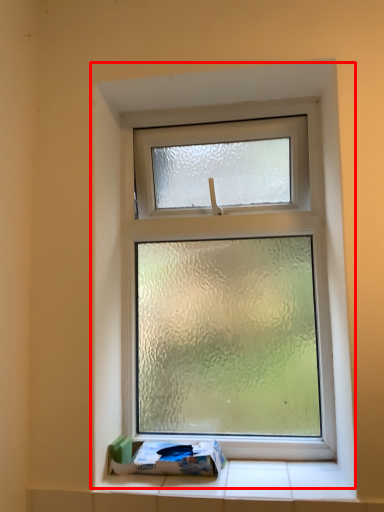
Question: In this image, where is window (annotated by the red box) located relative to box?

Choices:
 (A) right
 (B) left

Answer: (A)